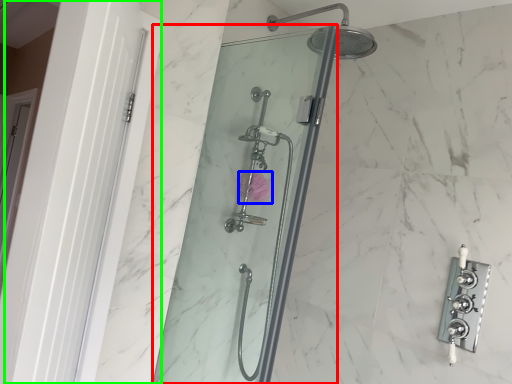
Question: Which is farther away from shower door (highlighted by a red box)? flower (highlighted by a blue box) or screen door (highlighted by a green box)?

Choices:
 (A) flower
 (B) screen door

Answer: (B)